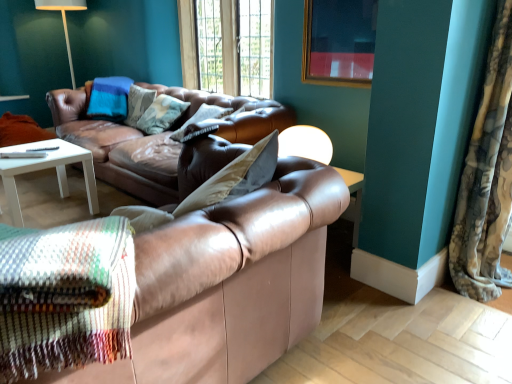
Question: Is fluffy fabric curtain at right wider than leather couch at center, which ranks as the 2th studio couch in back-to-front order?

Choices:
 (A) no
 (B) yes

Answer: (A)

Question: Is fluffy fabric curtain at right positioned far away from leather couch at center, marked as the 1th studio couch in a front-to-back arrangement?

Choices:
 (A) yes
 (B) no

Answer: (A)

Question: Is fluffy fabric curtain at right to the left of leather couch at center, marked as the 1th studio couch in a front-to-back arrangement, from the viewer's perspective?

Choices:
 (A) no
 (B) yes

Answer: (A)

Question: Is fluffy fabric curtain at right turned away from leather couch at center, marked as the 1th studio couch in a front-to-back arrangement?

Choices:
 (A) yes
 (B) no

Answer: (B)

Question: Can you confirm if fluffy fabric curtain at right is shorter than leather couch at center, which ranks as the 2th studio couch in back-to-front order?

Choices:
 (A) no
 (B) yes

Answer: (A)

Question: Does fluffy fabric curtain at right contain leather couch at center, which ranks as the 2th studio couch in back-to-front order?

Choices:
 (A) yes
 (B) no

Answer: (B)

Question: Is gold-framed picture at upper center to the right of fluffy fabric curtain at right from the viewer's perspective?

Choices:
 (A) yes
 (B) no

Answer: (B)

Question: Can you confirm if gold-framed picture at upper center is wider than fluffy fabric curtain at right?

Choices:
 (A) no
 (B) yes

Answer: (A)

Question: Could you tell me if gold-framed picture at upper center is facing fluffy fabric curtain at right?

Choices:
 (A) no
 (B) yes

Answer: (A)

Question: Is gold-framed picture at upper center placed right next to fluffy fabric curtain at right?

Choices:
 (A) yes
 (B) no

Answer: (B)

Question: Considering the relative positions of gold-framed picture at upper center and fluffy fabric curtain at right in the image provided, is gold-framed picture at upper center to the left of fluffy fabric curtain at right from the viewer's perspective?

Choices:
 (A) no
 (B) yes

Answer: (B)

Question: From the image's perspective, would you say gold-framed picture at upper center is positioned over fluffy fabric curtain at right?

Choices:
 (A) yes
 (B) no

Answer: (A)

Question: Is fluffy fabric curtain at right inside leather couch at center, which is the 1th studio couch from back to front?

Choices:
 (A) yes
 (B) no

Answer: (B)